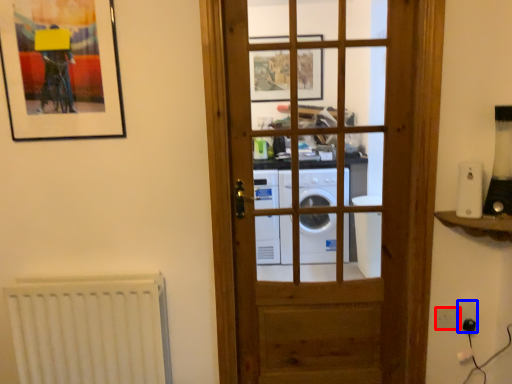
Question: Which object is further to the camera taking this photo, light switch (highlighted by a red box) or electric outlet (highlighted by a blue box)?

Choices:
 (A) light switch
 (B) electric outlet

Answer: (A)